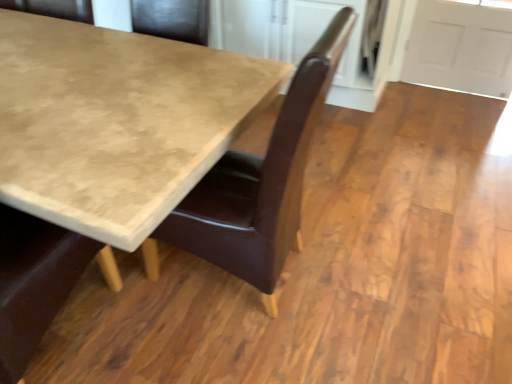
Question: From a real-world perspective, is brown leather chair at center positioned above or below marble-like beige table at center?

Choices:
 (A) above
 (B) below

Answer: (A)

Question: In terms of height, does brown leather chair at center look taller or shorter compared to marble-like beige table at center?

Choices:
 (A) tall
 (B) short

Answer: (A)

Question: Is brown leather chair at center inside or outside of marble-like beige table at center?

Choices:
 (A) inside
 (B) outside

Answer: (A)

Question: Is marble-like beige table at center in front of or behind brown leather chair at center in the image?

Choices:
 (A) behind
 (B) front

Answer: (B)

Question: Considering the positions of marble-like beige table at center and brown leather chair at center in the image, is marble-like beige table at center taller or shorter than brown leather chair at center?

Choices:
 (A) short
 (B) tall

Answer: (A)

Question: From the image's perspective, is marble-like beige table at center above or below brown leather chair at center?

Choices:
 (A) below
 (B) above

Answer: (B)

Question: Would you say marble-like beige table at center is inside or outside brown leather chair at center?

Choices:
 (A) inside
 (B) outside

Answer: (B)